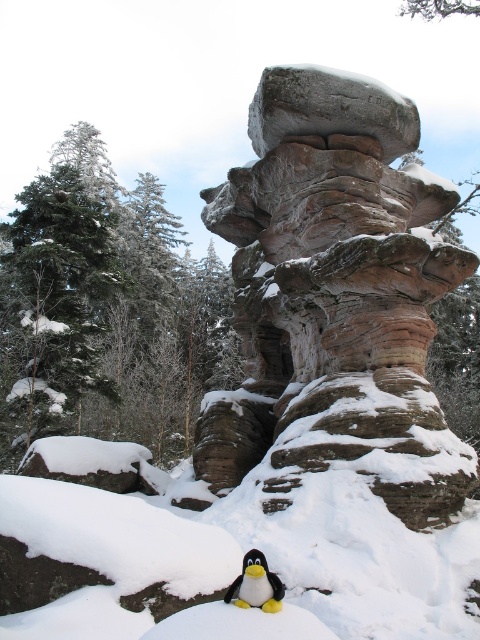
Question: Is rustic stone formation at center positioned before black plush penguin at lower center?

Choices:
 (A) yes
 (B) no

Answer: (B)

Question: Which object appears closest to the camera in this image?

Choices:
 (A) rustic stone formation at center
 (B) black plush penguin at lower center

Answer: (B)

Question: Considering the relative positions of rustic stone formation at center and black plush penguin at lower center in the image provided, where is rustic stone formation at center located with respect to black plush penguin at lower center?

Choices:
 (A) below
 (B) above

Answer: (B)

Question: Which point appears farthest from the camera in this image?

Choices:
 (A) (352, 129)
 (B) (241, 577)

Answer: (A)

Question: Is rustic stone formation at center to the left of black plush penguin at lower center from the viewer's perspective?

Choices:
 (A) no
 (B) yes

Answer: (A)

Question: Which point is farther to the camera?

Choices:
 (A) rustic stone formation at center
 (B) black plush penguin at lower center

Answer: (A)